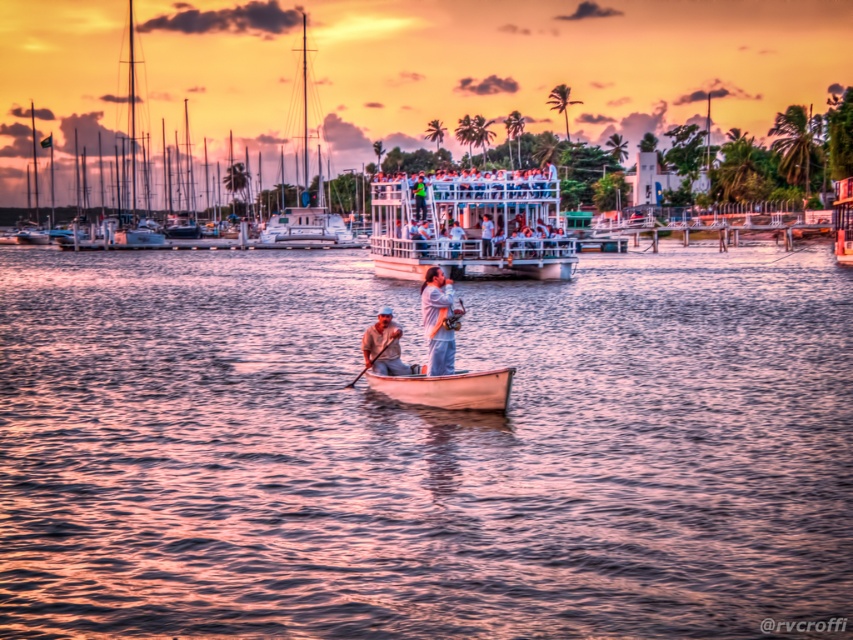
Question: Can you confirm if wooden canoe at center is positioned below light brown wooden oar at center?

Choices:
 (A) yes
 (B) no

Answer: (A)

Question: Can you confirm if shiny white sailboat at center is positioned below light brown wooden boat at center?

Choices:
 (A) no
 (B) yes

Answer: (A)

Question: Among these points, which one is nearest to the camera?

Choices:
 (A) tap(367, 368)
 (B) tap(416, 276)

Answer: (A)

Question: Can you confirm if wooden canoe at center is thinner than shiny white sailboat at center?

Choices:
 (A) yes
 (B) no

Answer: (A)

Question: Which point appears closest to the camera in this image?

Choices:
 (A) (498, 376)
 (B) (474, 243)

Answer: (A)

Question: Which of the following is the farthest from the observer?

Choices:
 (A) (434, 292)
 (B) (161, 580)

Answer: (A)